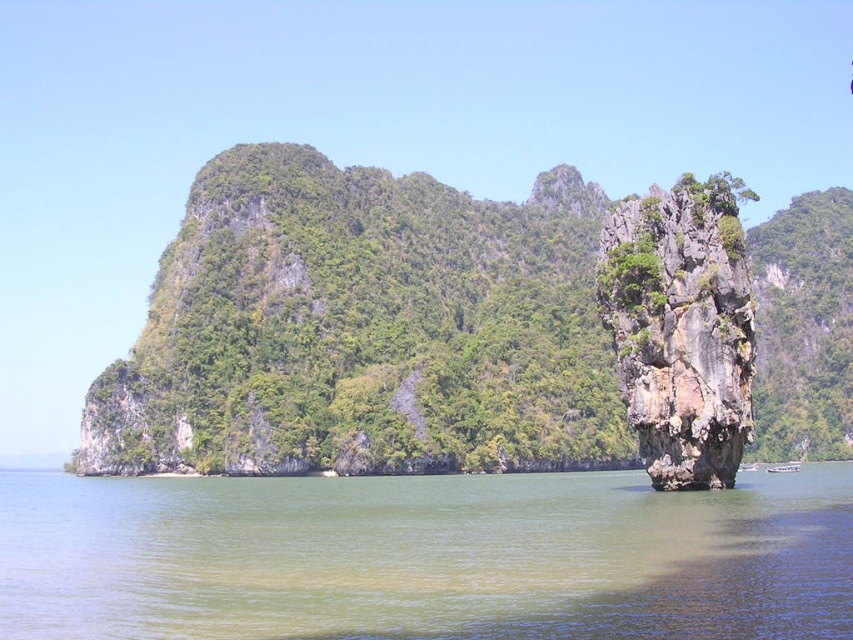
Question: Among these points, which one is farthest from the camera?

Choices:
 (A) (18, 554)
 (B) (747, 385)

Answer: (B)

Question: Does green water at center lie in front of rugged stone rock at right?

Choices:
 (A) no
 (B) yes

Answer: (B)

Question: Is the position of green water at center less distant than that of rugged stone rock at right?

Choices:
 (A) no
 (B) yes

Answer: (B)

Question: Does green water at center appear over rugged stone rock at right?

Choices:
 (A) yes
 (B) no

Answer: (B)

Question: Among these objects, which one is nearest to the camera?

Choices:
 (A) green water at center
 (B) rugged stone rock at right

Answer: (A)